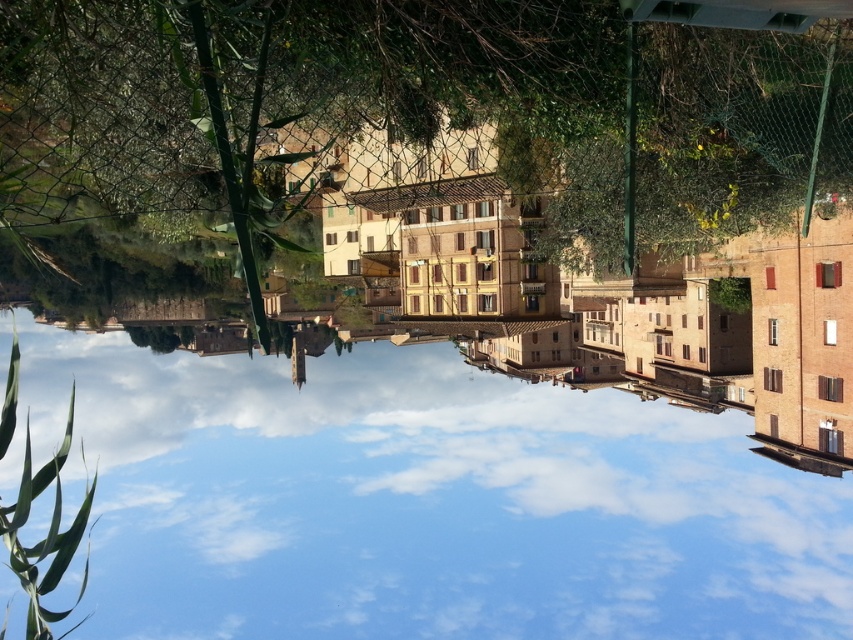
You are standing in front of the European town scene and want to determine which of the two points, point (575,636) or point (666,177), is closer to you. Based on the image, which point is nearer?

Point (575,636) is closer to you because it is further to the viewer than point (666,177).

You are a tourist standing in front of the European town scene. You notice a point marked at coordinates (419, 500). What is located at this point?

The point at (419, 500) marks transparent glass water at center.

You are standing in front of the European town scene. You see a transparent glass water at center and a green leafy tree at upper center. Which object is positioned to the right of the other?

The transparent glass water at center is to the right of the green leafy tree at upper center.